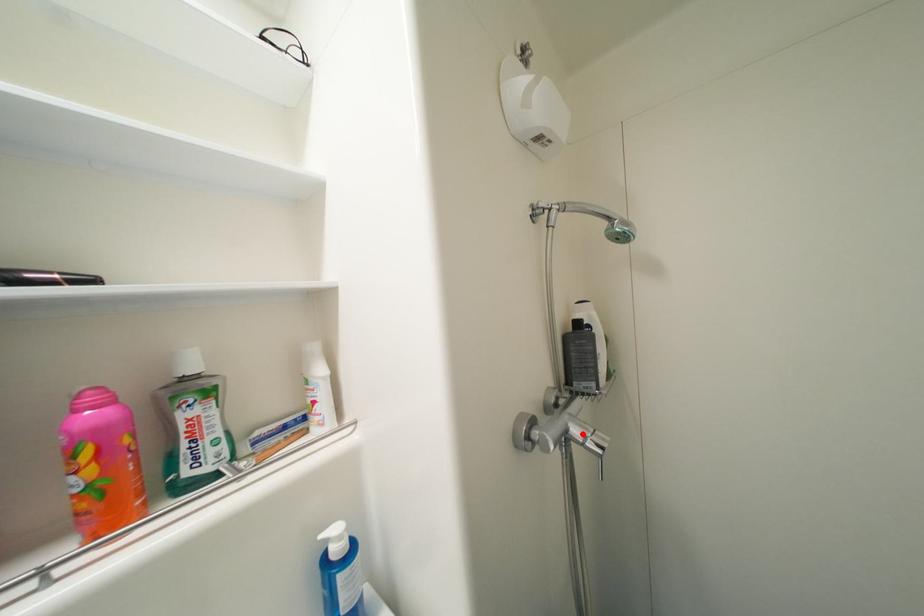
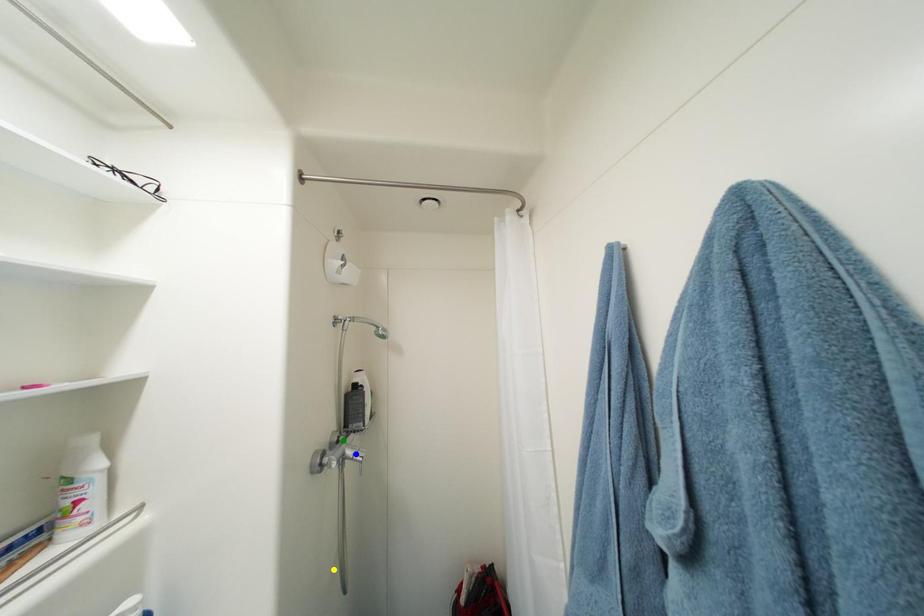
Question: I am providing you with two images of the same scene from different viewpoints. A red point is marked on the first image. You are given multiple points on the second image. Which spot in image 2 lines up with the point in image 1?

Choices:
 (A) blue point
 (B) yellow point
 (C) green point

Answer: (A)